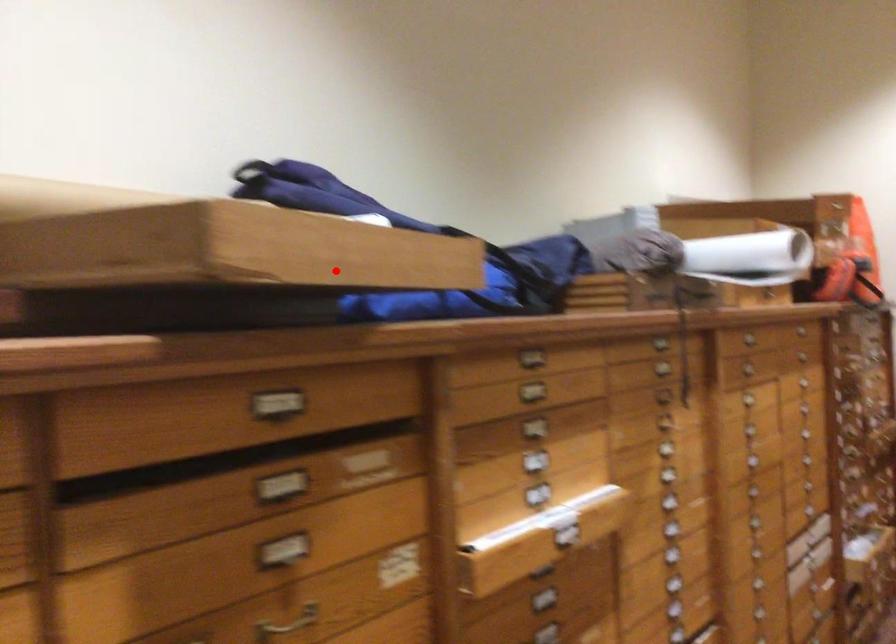
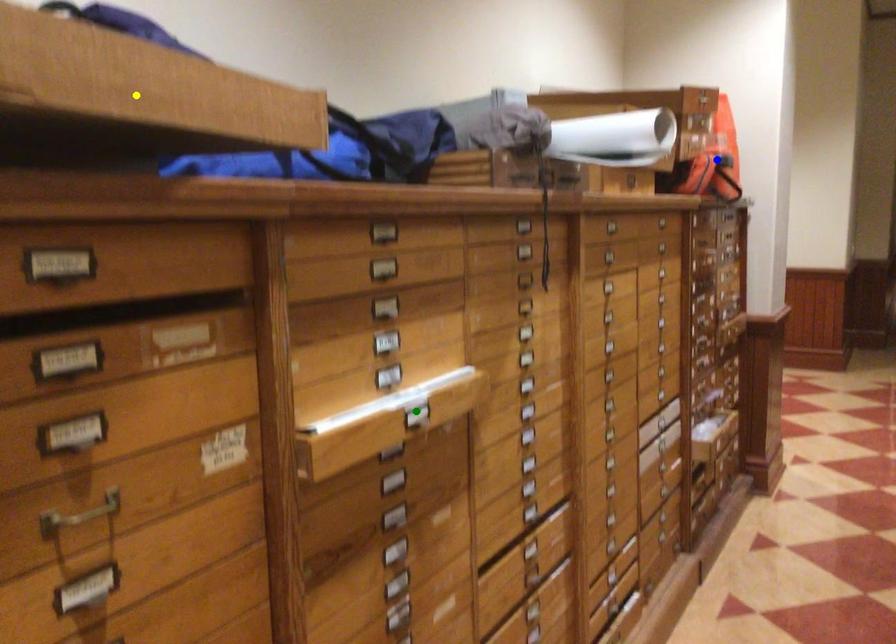
Question: I am providing you with two images of the same scene from different viewpoints. A red point is marked on the first image. You are given multiple points on the second image. Which point in image 2 represents the same 3d spot as the red point in image 1?

Choices:
 (A) yellow point
 (B) blue point
 (C) green point

Answer: (A)